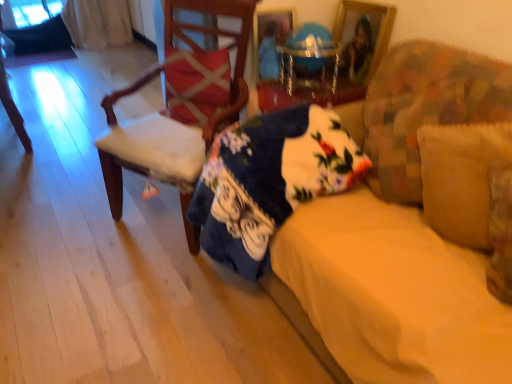
Question: Is floral cotton blanket at center bigger than wooden chair at left, which appears as the second chair when viewed from the left?

Choices:
 (A) yes
 (B) no

Answer: (B)

Question: From a real-world perspective, is floral cotton blanket at center physically below wooden chair at left, which appears as the 1th chair when viewed from the front?

Choices:
 (A) no
 (B) yes

Answer: (B)

Question: Is wooden chair at left, which is the second chair from back to front, surrounded by floral cotton blanket at center?

Choices:
 (A) yes
 (B) no

Answer: (B)

Question: Does floral cotton blanket at center have a lesser height compared to wooden chair at left, which appears as the second chair when viewed from the left?

Choices:
 (A) no
 (B) yes

Answer: (B)

Question: Does floral cotton blanket at center have a smaller size compared to wooden chair at left, which is the second chair from back to front?

Choices:
 (A) yes
 (B) no

Answer: (A)

Question: Is suede-like beige pillow at right, positioned as the 1th pillow in right-to-left order, to the left or to the right of matte white chair at left, which is counted as the second chair, starting from the right, in the image?

Choices:
 (A) right
 (B) left

Answer: (A)

Question: Is point (450, 203) positioned closer to the camera than point (30, 150)?

Choices:
 (A) closer
 (B) farther

Answer: (A)

Question: Looking at their shapes, would you say suede-like beige pillow at right, positioned as the 1th pillow in right-to-left order, is wider or thinner than matte white chair at left, which is counted as the second chair, starting from the right?

Choices:
 (A) thin
 (B) wide

Answer: (A)

Question: From the image's perspective, is suede-like beige pillow at right, arranged as the first pillow when viewed from the front, above or below matte white chair at left, which is counted as the second chair, starting from the right?

Choices:
 (A) above
 (B) below

Answer: (B)

Question: Is floral cotton blanket at center to the left or to the right of suede-like beige pillow at right, acting as the first pillow starting from the bottom, in the image?

Choices:
 (A) left
 (B) right

Answer: (A)

Question: From the image's perspective, is floral cotton blanket at center above or below suede-like beige pillow at right, arranged as the first pillow when viewed from the front?

Choices:
 (A) below
 (B) above

Answer: (B)

Question: From a real-world perspective, is floral cotton blanket at center positioned above or below suede-like beige pillow at right, acting as the first pillow starting from the bottom?

Choices:
 (A) below
 (B) above

Answer: (A)

Question: Considering the positions of floral cotton blanket at center and suede-like beige pillow at right, the 2th pillow in the back-to-front sequence, in the image, is floral cotton blanket at center taller or shorter than suede-like beige pillow at right, the 2th pillow in the back-to-front sequence,?

Choices:
 (A) tall
 (B) short

Answer: (A)

Question: From their relative heights in the image, would you say wooden picture frame at upper center is taller or shorter than metallic blue globe at center?

Choices:
 (A) tall
 (B) short

Answer: (A)

Question: Is wooden picture frame at upper center bigger or smaller than metallic blue globe at center?

Choices:
 (A) big
 (B) small

Answer: (B)